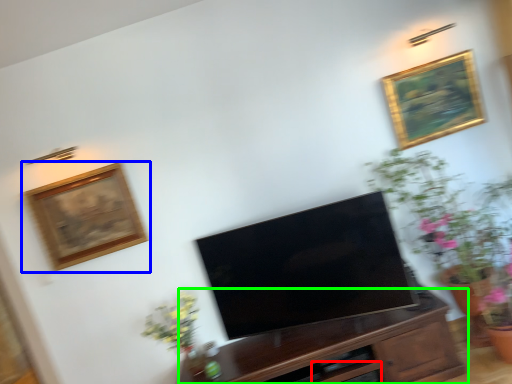
Question: Which is nearer to the drawer (highlighted by a red box)? picture frame (highlighted by a blue box) or cabinetry (highlighted by a green box).

Choices:
 (A) picture frame
 (B) cabinetry

Answer: (B)